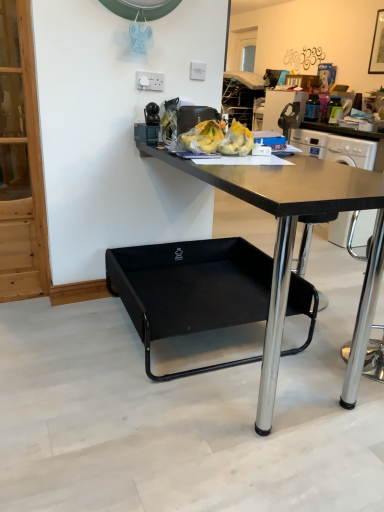
Question: From the image's perspective, is white plastic power outlet at upper center, which is the first power outlet from back to front, above or below white plastic power outlet at upper center, which appears as the 2th power outlet when viewed from the right?

Choices:
 (A) below
 (B) above

Answer: (B)

Question: From a real-world perspective, is white plastic power outlet at upper center, the 2th power outlet in the front-to-back sequence, above or below white plastic power outlet at upper center, which appears as the 2th power outlet when viewed from the right?

Choices:
 (A) above
 (B) below

Answer: (A)

Question: Which is farther from the metallic black coffee machine at upper right?

Choices:
 (A) black fabric swivel chair at lower center
 (B) matte black tray at upper center
 (C) yellow plastic bananas at center
 (D) white plastic power outlet at upper center, which is counted as the 1th power outlet, starting from the front
 (E) black matte desk at center

Answer: (E)

Question: Which of these objects is positioned closest to the white plastic power outlet at upper center, which ranks as the 1th power outlet in right-to-left order?

Choices:
 (A) black fabric swivel chair at lower center
 (B) yellow plastic bananas at center
 (C) metallic black coffee machine at upper right
 (D) matte black tray at upper center
 (E) black glass picture frame at upper right

Answer: (D)